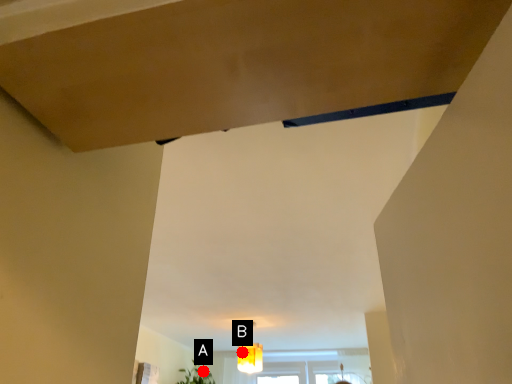
Question: Two points are circled on the image, labeled by A and B beside each circle. Which point is closer to the camera taking this photo?

Choices:
 (A) A is closer
 (B) B is closer

Answer: (B)